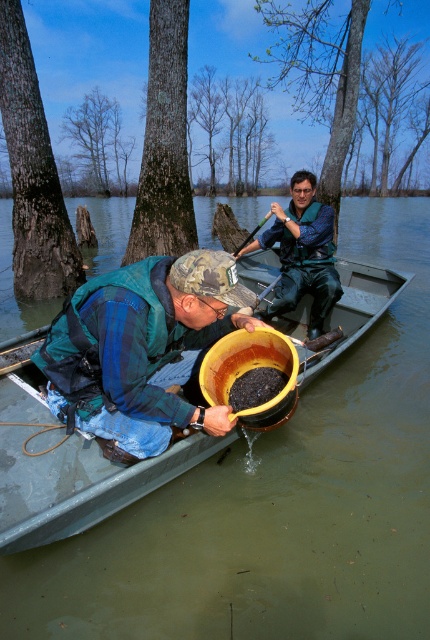
You are standing on the edge of the swamp and see the camouflage fabric hat at center and the green plastic boat at center. Which object is positioned to the right side?

The camouflage fabric hat at center is to the right of the green plastic boat at center.

You are a photographer trying to capture the scene from the camera position. Which of the two points, point (279, 230) or point (258, 225), will appear closer to the camera in your photo?

Point (279, 230) is further to the camera than point (258, 225), so it will appear closer to the camera in the photo.

You are a drone operator trying to locate a specific object in an image. The scene shows a person in a swampy area pouring water from a bucket into the water. You need to determine the exact coordinates of the blue fabric jacket at center. What are its coordinates?

The blue fabric jacket at center is located at coordinates point (303,253).